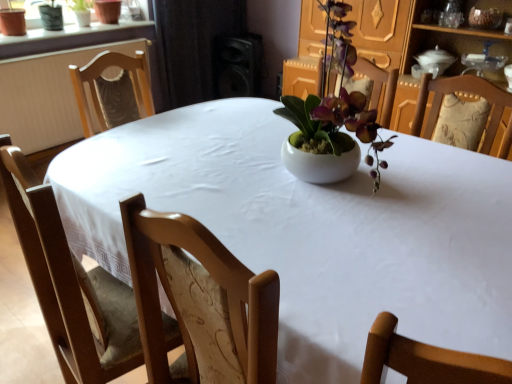
From the picture: What is the approximate width of green matte plant at upper left?

green matte plant at upper left is 6.57 inches wide.

Where is `green matte plant at upper left`? This screenshot has height=384, width=512. green matte plant at upper left is located at coordinates (81, 11).

The image size is (512, 384). Describe the element at coordinates (81, 11) in the screenshot. I see `green matte plant at upper left` at that location.

The height and width of the screenshot is (384, 512). Find the location of `black matte speaker at upper center`. black matte speaker at upper center is located at coordinates click(x=237, y=65).

Image resolution: width=512 pixels, height=384 pixels. What do you see at coordinates (237, 65) in the screenshot? I see `black matte speaker at upper center` at bounding box center [237, 65].

Locate an element on the screen. green matte plant at upper left is located at coordinates (81, 11).

Visually, is green matte plant at upper left positioned to the left or to the right of black matte speaker at upper center?

In the image, green matte plant at upper left appears on the left side of black matte speaker at upper center.

Between green matte plant at upper left and black matte speaker at upper center, which one is positioned behind?

black matte speaker at upper center is further away from the camera.

Is point (80, 23) positioned behind point (218, 60)?

No, (80, 23) is in front of (218, 60).

From the image's perspective, is green matte plant at upper left located beneath black matte speaker at upper center?

No, from the image's perspective, green matte plant at upper left is not below black matte speaker at upper center.

From a real-world perspective, is green matte plant at upper left positioned over black matte speaker at upper center based on gravity?

Indeed, from a real-world perspective, green matte plant at upper left stands above black matte speaker at upper center.

Between green matte plant at upper left and black matte speaker at upper center, which one has smaller width?

With smaller width is green matte plant at upper left.

Considering the sizes of green matte plant at upper left and black matte speaker at upper center in the image, is green matte plant at upper left taller or shorter than black matte speaker at upper center?

In the image, green matte plant at upper left appears to be shorter than black matte speaker at upper center.

Based on the photo, is green matte plant at upper left bigger or smaller than black matte speaker at upper center?

Considering their sizes, green matte plant at upper left takes up less space than black matte speaker at upper center.

Does green matte plant at upper left contain black matte speaker at upper center?

That's incorrect, black matte speaker at upper center is not inside green matte plant at upper left.

Is green matte plant at upper left in contact with black matte speaker at upper center?

No, green matte plant at upper left is not making contact with black matte speaker at upper center.

Consider the image. Is green matte plant at upper left facing towards black matte speaker at upper center?

No, green matte plant at upper left is not facing towards black matte speaker at upper center.

The width and height of the screenshot is (512, 384). In order to click on speaker to the right of green matte plant at upper left in this screenshot , I will do [x=237, y=65].

Which is more to the right, black matte speaker at upper center or green matte plant at upper left?

black matte speaker at upper center is more to the right.

Is black matte speaker at upper center further to the viewer compared to green matte plant at upper left?

Yes, it is.

Which is in front, point (217, 36) or point (76, 8)?

The point (76, 8) is closer to the camera.

From the image's perspective, is black matte speaker at upper center below green matte plant at upper left?

Yes, from the image's perspective, black matte speaker at upper center is beneath green matte plant at upper left.

From a real-world perspective, which object stands above the other?

green matte plant at upper left is physically above.

In the scene shown: Is black matte speaker at upper center wider than green matte plant at upper left?

Yes.

Is black matte speaker at upper center taller than green matte plant at upper left?

Yes.

In the scene shown: Does black matte speaker at upper center have a smaller size compared to green matte plant at upper left?

No.

Is black matte speaker at upper center not inside green matte plant at upper left?

black matte speaker at upper center is positioned outside green matte plant at upper left.

Is black matte speaker at upper center in contact with green matte plant at upper left?

They are not placed beside each other.

Is black matte speaker at upper center aimed at green matte plant at upper left?

No, black matte speaker at upper center is not facing towards green matte plant at upper left.

Where is `speaker that is on the right side of green matte plant at upper left`? This screenshot has width=512, height=384. speaker that is on the right side of green matte plant at upper left is located at coordinates (237, 65).

Where is `speaker that appears below the green matte plant at upper left (from the image's perspective)`? speaker that appears below the green matte plant at upper left (from the image's perspective) is located at coordinates (237, 65).

Image resolution: width=512 pixels, height=384 pixels. I want to click on houseplant on the left of the black matte speaker at upper center, so click(81, 11).